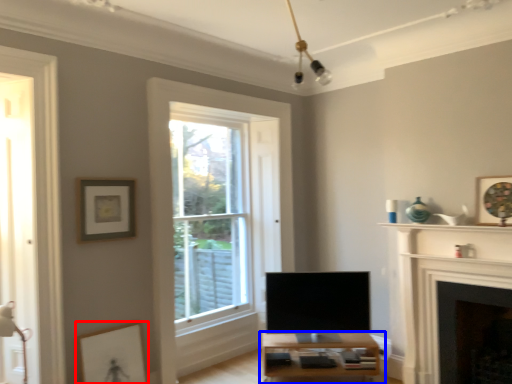
Question: Which object appears closest to the camera in this image, picture frame (highlighted by a red box) or table (highlighted by a blue box)?

Choices:
 (A) picture frame
 (B) table

Answer: (A)